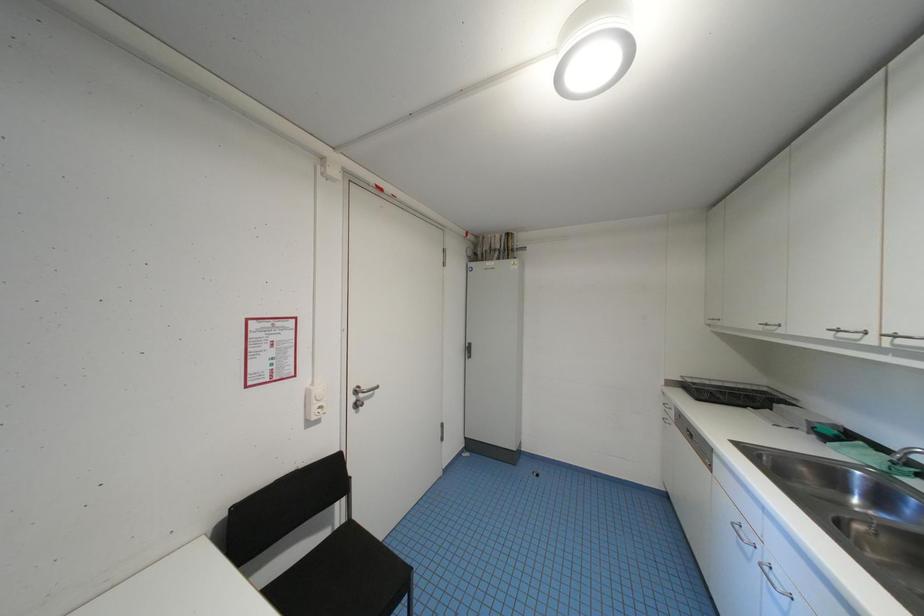
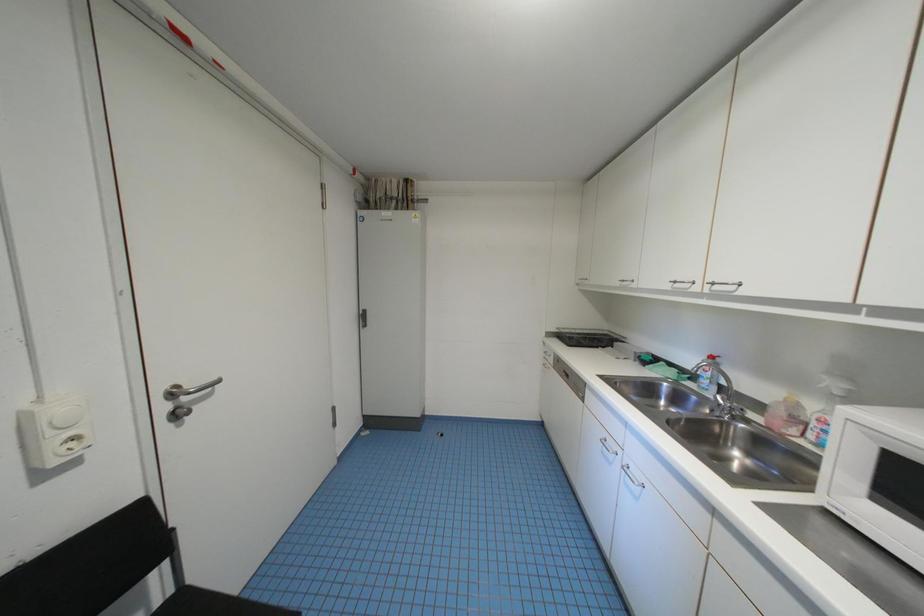
Question: How did the camera likely rotate?

Choices:
 (A) Left
 (B) Right
 (C) Up
 (D) Down

Answer: (B)